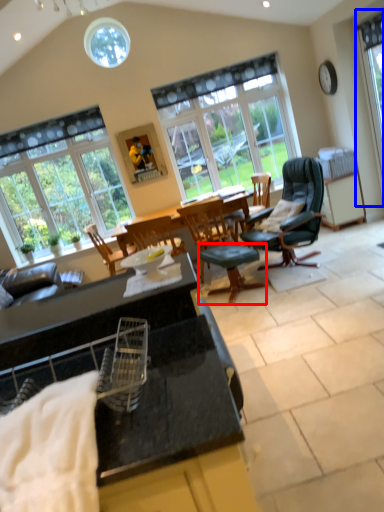
Question: Which object is further to the camera taking this photo, stool (highlighted by a red box) or window (highlighted by a blue box)?

Choices:
 (A) stool
 (B) window

Answer: (B)